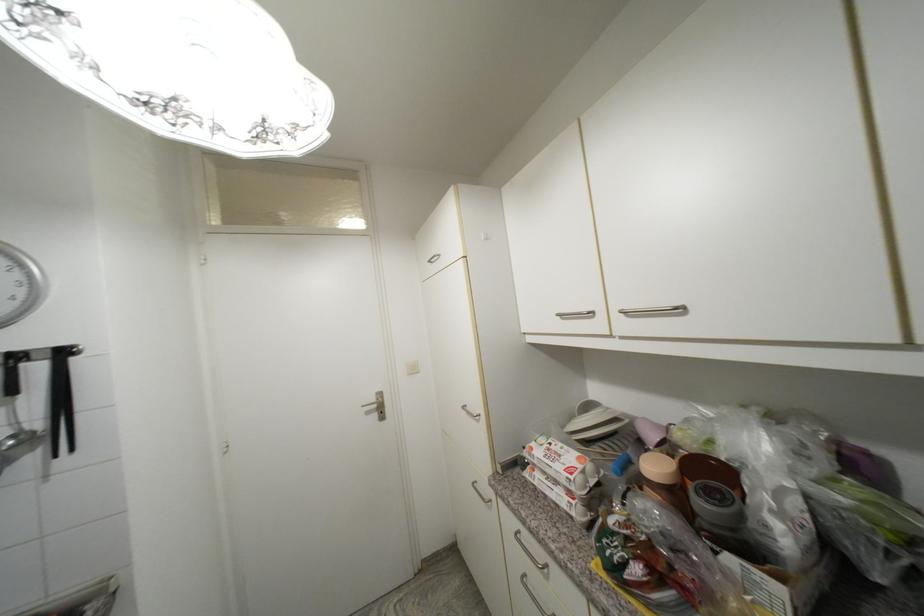
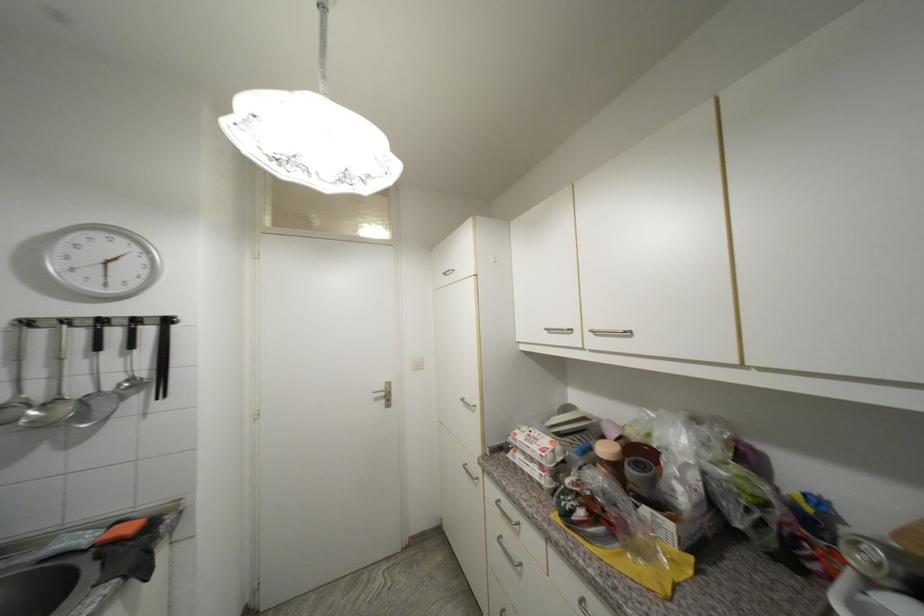
Locate, in the second image, the point that corresponds to (x=572, y=448) in the first image.

(548, 436)